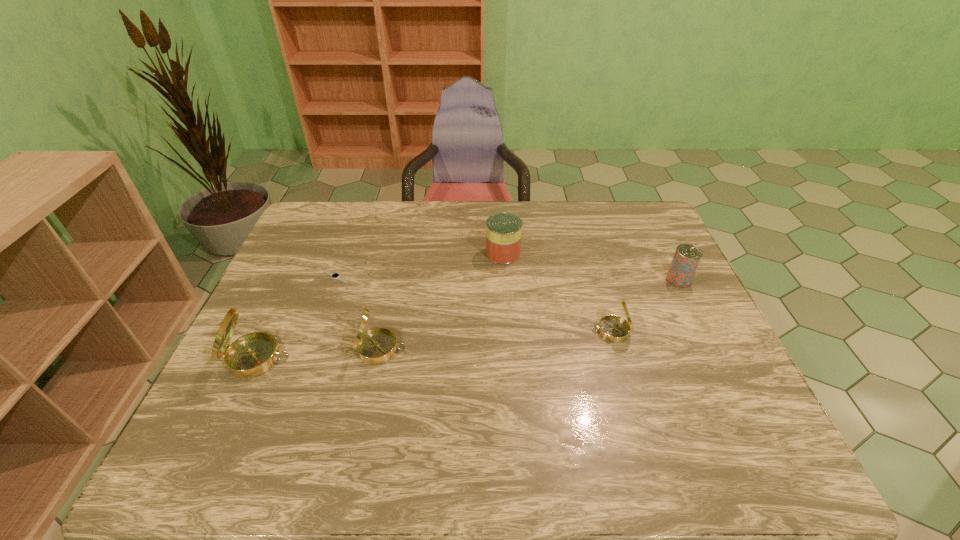
Where is `the leftmost compass`? The width and height of the screenshot is (960, 540). the leftmost compass is located at coordinates (253, 354).

Locate an element on the screen. This screenshot has width=960, height=540. the leftmost object is located at coordinates pos(253,354).

This screenshot has height=540, width=960. I want to click on the second shortest compass, so click(377, 345).

Locate an element on the screen. The width and height of the screenshot is (960, 540). the second compass from left to right is located at coordinates (377, 345).

Where is `the second object from right to left`? the second object from right to left is located at coordinates (614, 328).

Find the location of `the rightmost compass`. the rightmost compass is located at coordinates (614, 328).

Where is `the fourth object from left to right`? The height and width of the screenshot is (540, 960). the fourth object from left to right is located at coordinates (503, 230).

Where is `the farthest object`? The height and width of the screenshot is (540, 960). the farthest object is located at coordinates (503, 230).

Find the location of `watch`. watch is located at coordinates (336, 276).

Find the location of `the shortest object`. the shortest object is located at coordinates (336, 276).